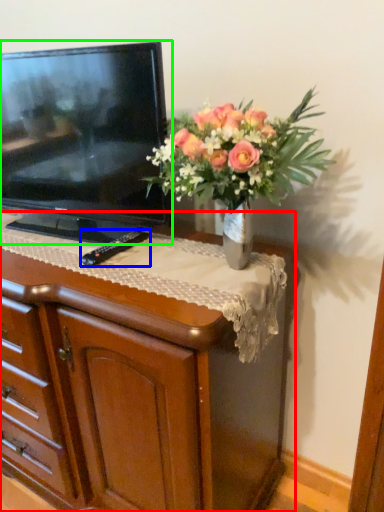
Question: Which object is the closest to the chest of drawers (highlighted by a red box)? Choose among these: remote (highlighted by a blue box) or television (highlighted by a green box).

Choices:
 (A) remote
 (B) television

Answer: (B)